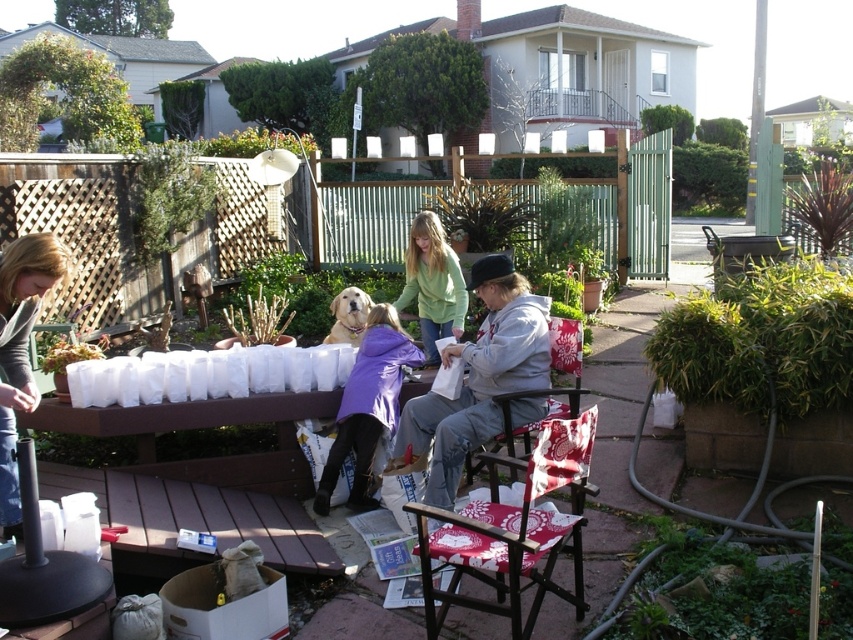
You are organizing a charity event and need to decide which clothing item to display first. The purple fleece jacket at center and the matte gray shirt at left are both available. Based on their sizes, which one should you choose to place in the spotlight first?

The purple fleece jacket at center has a smaller size compared to the matte gray shirt at left. Since it is smaller, you should place the purple fleece jacket at center in the spotlight first to ensure it is visible and not overshadowed by the larger matte gray shirt at left.